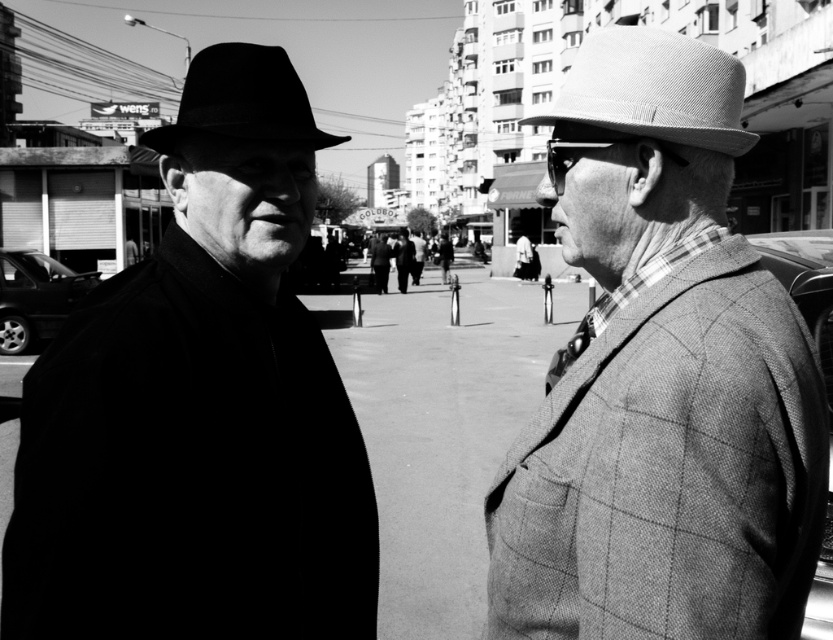
Is matte black hat at left bigger than textured gray cowboy hat at upper right?

No, matte black hat at left is not bigger than textured gray cowboy hat at upper right.

Which is in front, point (275, 532) or point (661, 44)?

Point (661, 44) is in front.

You are a GUI agent. You are given a task and a screenshot of the screen. Output one action in this format:
    pyautogui.click(x=<x>, y=<y>)
    Task: Click on the matte black hat at left
    The height and width of the screenshot is (640, 833).
    Given the screenshot: What is the action you would take?
    tap(198, 406)

The width and height of the screenshot is (833, 640). Identify the location of matte black hat at left. (198, 406).

Can you confirm if matte black hat at left is positioned to the right of plaid wool jacket at right?

No, matte black hat at left is not to the right of plaid wool jacket at right.

From the picture: Is matte black hat at left taller than plaid wool jacket at right?

Correct, matte black hat at left is much taller as plaid wool jacket at right.

Which is behind, point (53, 618) or point (634, 477)?

Point (53, 618)

Identify the location of matte black hat at left. (198, 406).

Is textured gray cowboy hat at upper right further to camera compared to matte black fedora at upper left?

No, it is not.

Can you confirm if textured gray cowboy hat at upper right is bigger than matte black fedora at upper left?

No, textured gray cowboy hat at upper right is not bigger than matte black fedora at upper left.

Between point (727, 67) and point (242, 116), which one is positioned in front?

Positioned in front is point (727, 67).

Where is `textured gray cowboy hat at upper right`? This screenshot has height=640, width=833. textured gray cowboy hat at upper right is located at coordinates (652, 90).